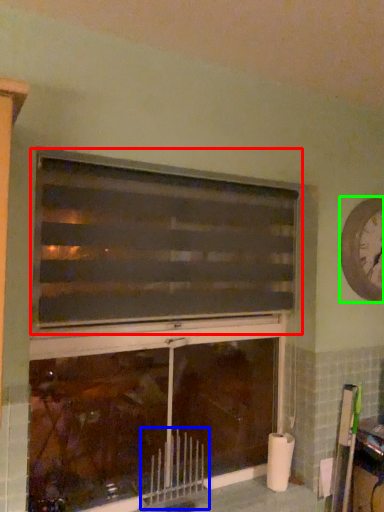
Question: Which object is the closest to the window (highlighted by a red box)? Choose among these: radiator (highlighted by a blue box) or clock (highlighted by a green box).

Choices:
 (A) radiator
 (B) clock

Answer: (B)